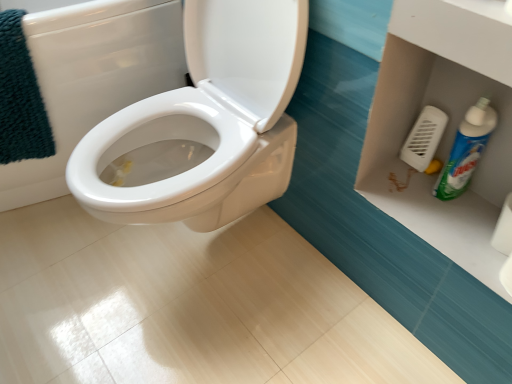
Question: From the image's perspective, is teal plush bath towel at upper left located above or below white glossy toilet at center?

Choices:
 (A) above
 (B) below

Answer: (B)

Question: Is teal plush bath towel at upper left wider or thinner than white glossy toilet at center?

Choices:
 (A) wide
 (B) thin

Answer: (B)

Question: Considering the real-world distances, which object is closest to the white plastic vent at right?

Choices:
 (A) teal plush bath towel at upper left
 (B) green plastic bottle at lower right
 (C) white plastic shelf at upper right
 (D) white glossy toilet at center

Answer: (B)

Question: Based on their relative distances, which object is nearer to the white plastic vent at right?

Choices:
 (A) teal plush bath towel at upper left
 (B) white plastic shelf at upper right
 (C) white glossy toilet at center
 (D) green plastic bottle at lower right

Answer: (D)